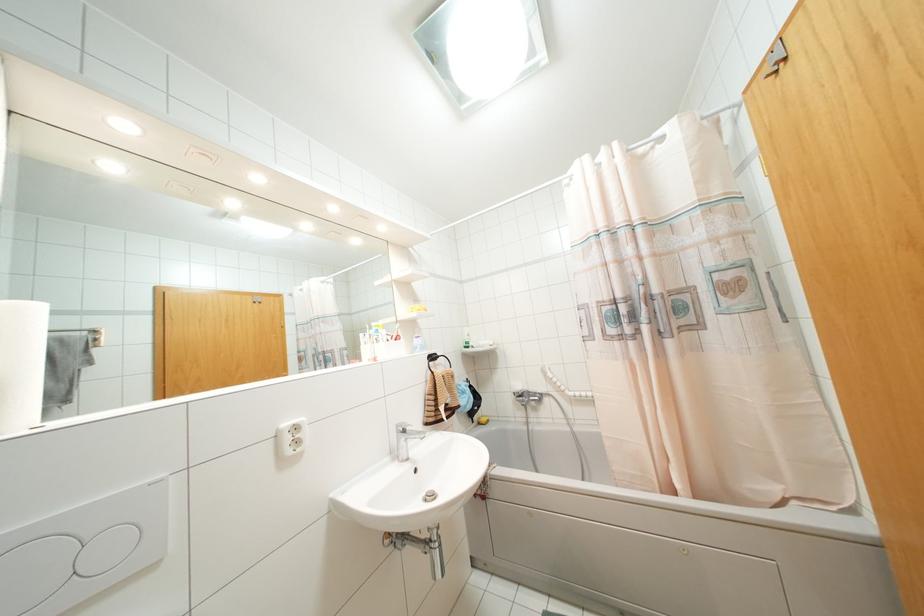
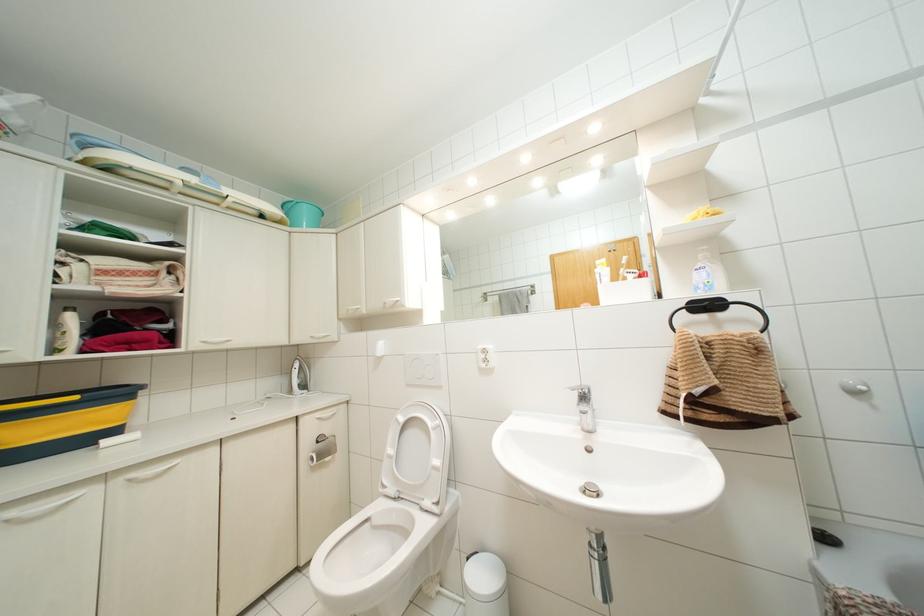
Question: The camera is either moving clockwise (left) or counter-clockwise (right) around the object. The first image is from the beginning of the video and the second image is from the end. Is the camera moving left or right when shooting the video?

Choices:
 (A) Left
 (B) Right

Answer: (B)